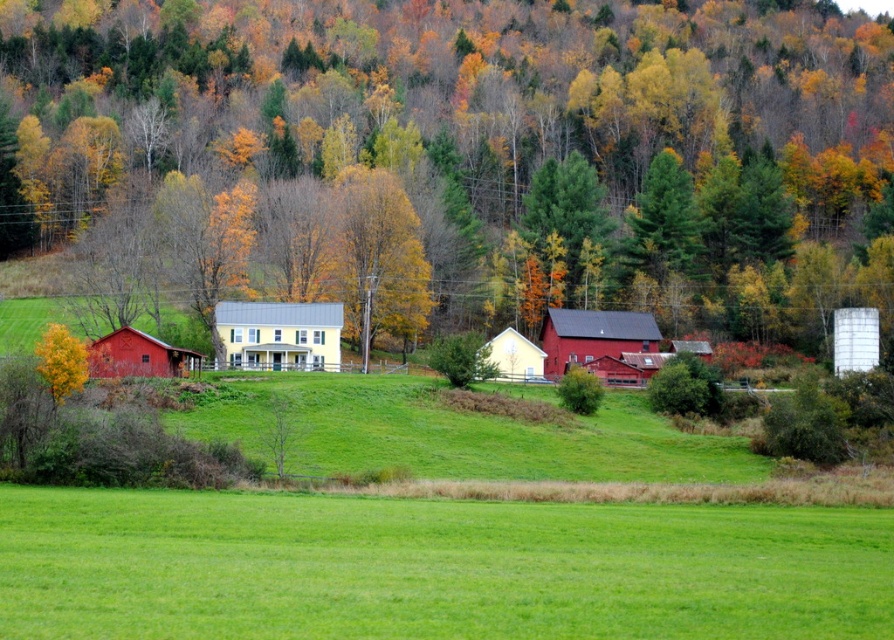
Question: Which object is closer to the camera taking this photo?

Choices:
 (A) yellow leafy tree at center
 (B) yellow matte house at center

Answer: (A)

Question: Estimate the real-world distances between objects in this image. Which object is farther from the yellow matte house at center?

Choices:
 (A) green grass field at lower center
 (B) white matte barn at center
 (C) yellow leafy tree at center
 (D) green matte tree at upper center

Answer: (A)

Question: Which of the following is the farthest from the observer?

Choices:
 (A) green grass field at lower center
 (B) white matte barn at center

Answer: (B)

Question: Is green grass field at lower center to the right of yellow leafy tree at center from the viewer's perspective?

Choices:
 (A) no
 (B) yes

Answer: (B)

Question: Is yellow leafy tree at center to the left of white matte barn at center from the viewer's perspective?

Choices:
 (A) yes
 (B) no

Answer: (A)

Question: Is green grass field at lower center below yellow matte house at center?

Choices:
 (A) no
 (B) yes

Answer: (B)